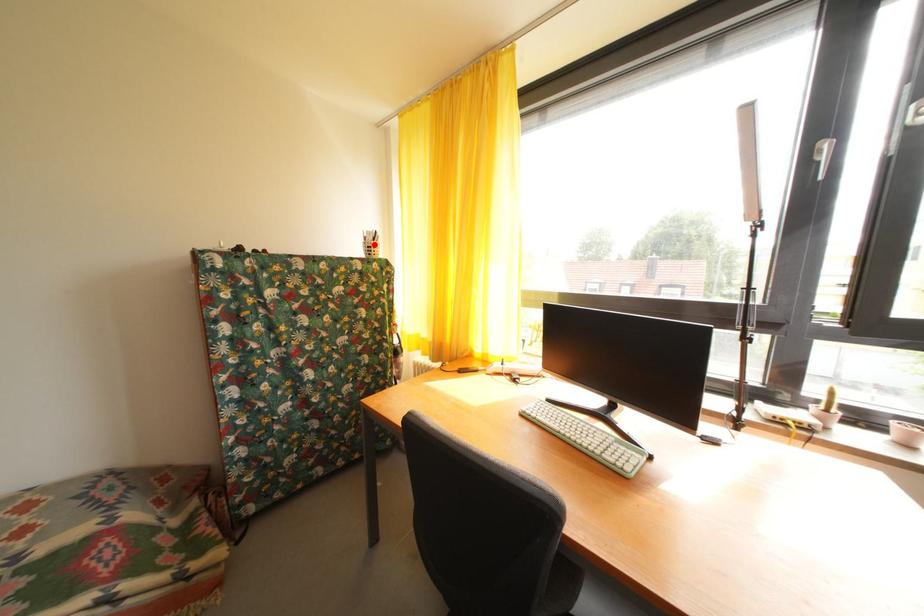
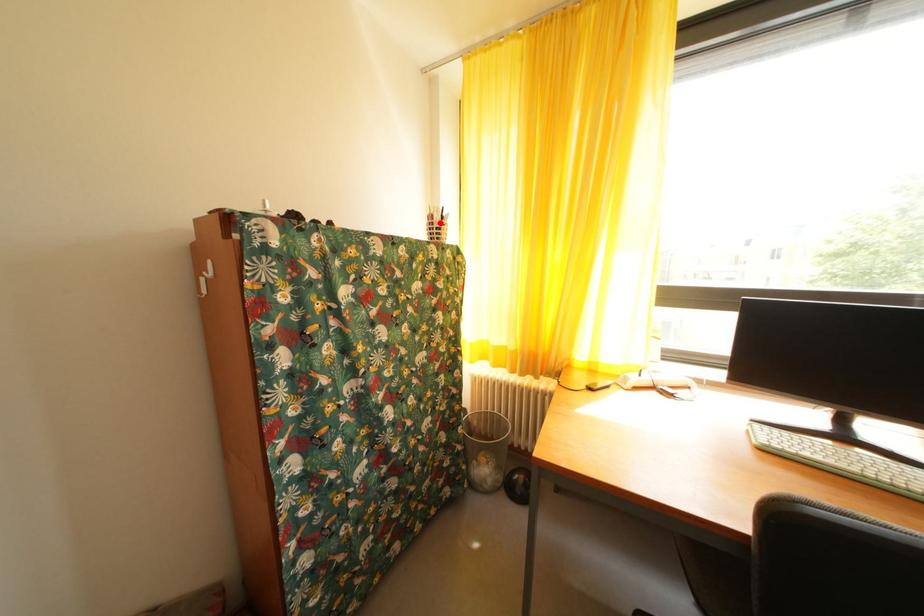
I am providing you with two images of the same scene from different viewpoints. A red point is marked on the first image and another point is marked on the second image. Are the points marked in image1 and image2 representing the same 3D position?

Yes